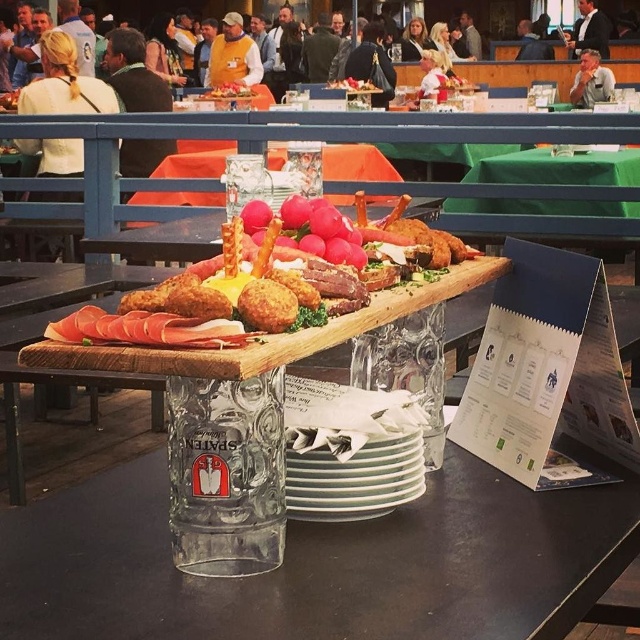
You are setting up a display and need to place a decorative item that requires a base wider than the smooth wooden board at center. Can the transparent glass at center provide a stable base for this item?

The transparent glass at center might be wider than the smooth wooden board at center, so it could potentially provide a stable base for the decorative item if its width is sufficient.

You are at the lively outdoor dining area and want to reach two points marked in the image. Which point, point (369, 285) or point (211, 97), is closer to you?

Point (369, 285) is closer to the viewer than point (211, 97).